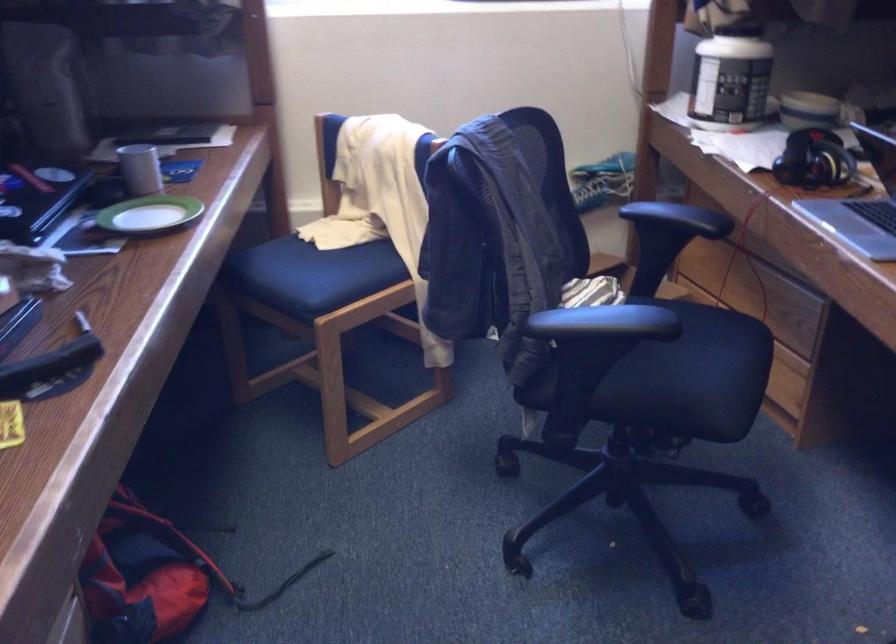
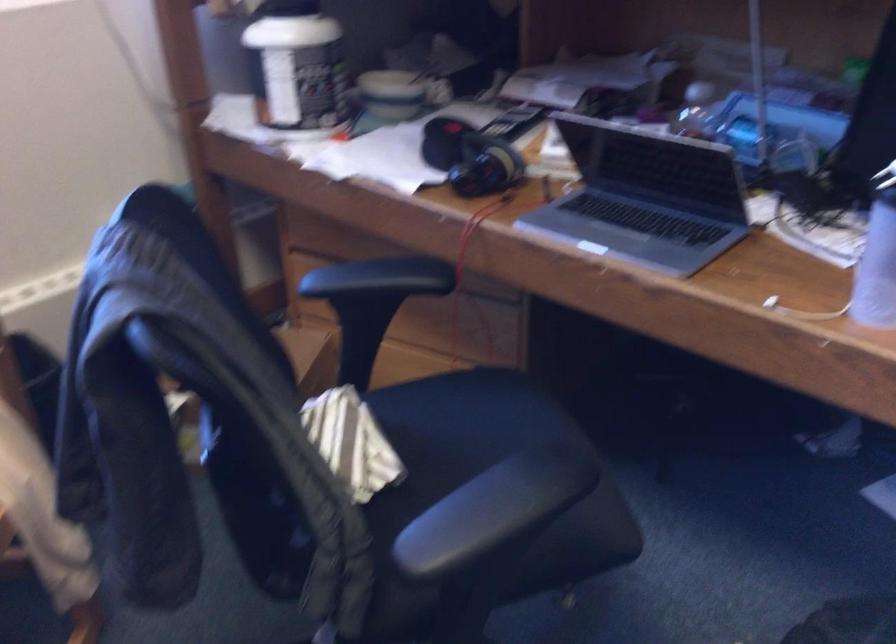
Where in the second image is the point corresponding to (812,152) from the first image?

(470, 158)